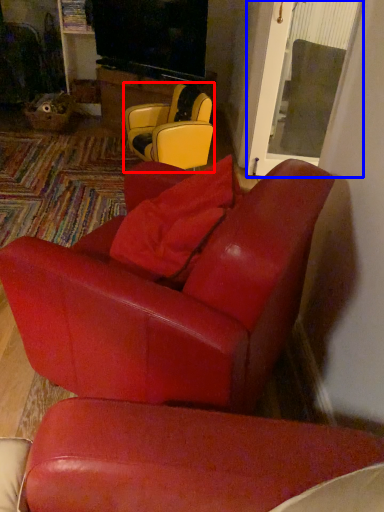
Question: Which object appears closest to the camera in this image, chair (highlighted by a red box) or glass door (highlighted by a blue box)?

Choices:
 (A) chair
 (B) glass door

Answer: (A)